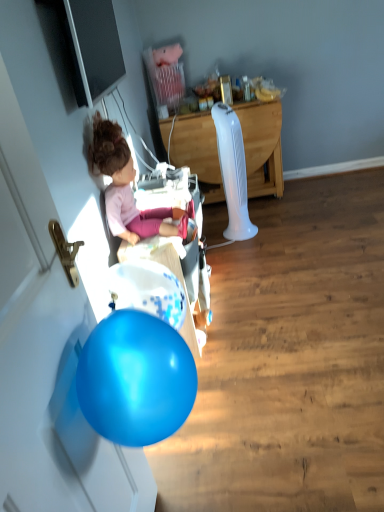
Question: Does point (163, 233) appear closer or farther from the camera than point (258, 105)?

Choices:
 (A) closer
 (B) farther

Answer: (A)

Question: In the image, is matte pink doll at left positioned in front of or behind white plastic fan at center?

Choices:
 (A) front
 (B) behind

Answer: (A)

Question: From their relative heights in the image, would you say matte pink doll at left is taller or shorter than white plastic fan at center?

Choices:
 (A) tall
 (B) short

Answer: (B)

Question: From their relative heights in the image, would you say white plastic fan at center is taller or shorter than matte pink doll at left?

Choices:
 (A) tall
 (B) short

Answer: (A)

Question: In terms of width, does white plastic fan at center look wider or thinner when compared to matte pink doll at left?

Choices:
 (A) wide
 (B) thin

Answer: (A)

Question: Considering their positions, is white plastic fan at center located in front of or behind matte pink doll at left?

Choices:
 (A) behind
 (B) front

Answer: (A)

Question: In terms of size, does white plastic fan at center appear bigger or smaller than matte pink doll at left?

Choices:
 (A) big
 (B) small

Answer: (A)